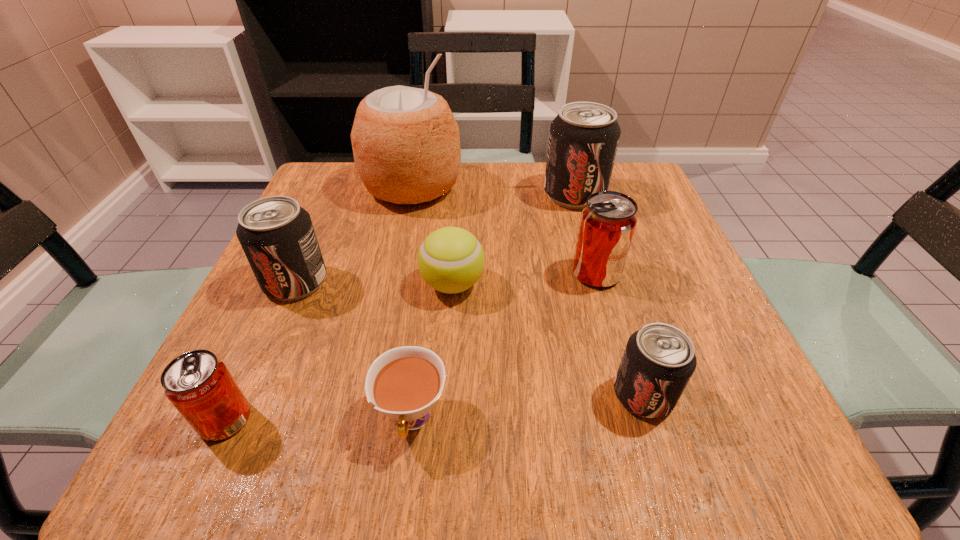
Where is `coconut`? This screenshot has height=540, width=960. coconut is located at coordinates (406, 145).

The image size is (960, 540). Find the location of `the biggest black soda can`. the biggest black soda can is located at coordinates (584, 136).

You are a GUI agent. You are given a task and a screenshot of the screen. Output one action in this format:
    pyautogui.click(x=<x>, y=<y>)
    Task: Click on the farthest pop soda
    
    Given the screenshot: What is the action you would take?
    pyautogui.click(x=584, y=136)

Locate an element on the screen. The width and height of the screenshot is (960, 540). the farther red pop soda is located at coordinates (608, 221).

What are the coordinates of `the right red pop soda` in the screenshot? It's located at (608, 221).

This screenshot has width=960, height=540. What are the coordinates of `the leftmost black soda can` in the screenshot? It's located at (277, 236).

Image resolution: width=960 pixels, height=540 pixels. Identify the location of the second smallest black soda can. (277, 236).

This screenshot has height=540, width=960. Identify the location of tennis ball. (451, 260).

What are the coordinates of `the smallest black soda can` in the screenshot? It's located at (659, 359).

I want to click on the left red pop soda, so click(199, 385).